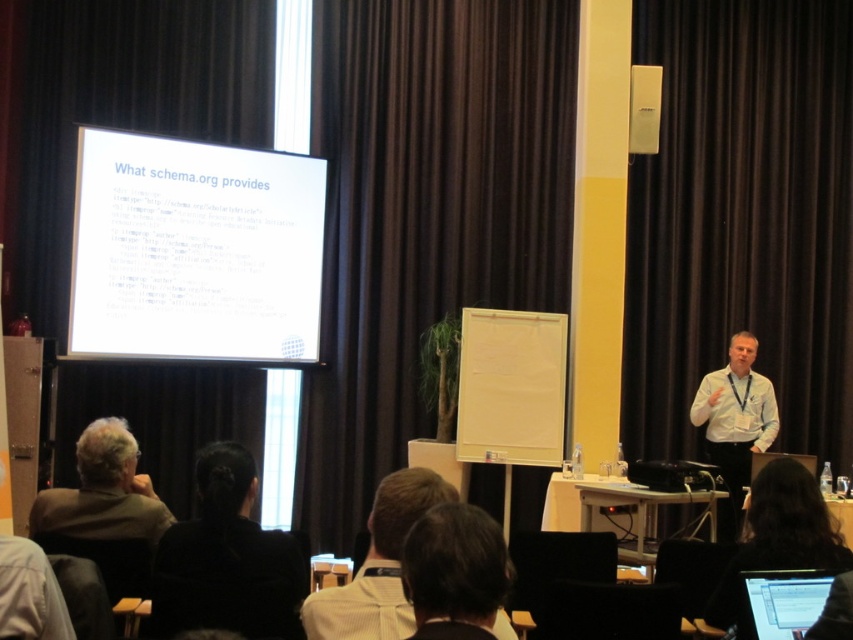
Which is more to the left, white paper at upper center or black fabric hair at lower center?

white paper at upper center is more to the left.

Can you confirm if white paper at upper center is smaller than black fabric hair at lower center?

No.

Does point (212, 326) come behind point (231, 552)?

Yes, point (212, 326) is behind point (231, 552).

At what (x,y) coordinates should I click in order to perform the action: click on white paper at upper center. Please return your answer as a coordinate pair (x, y). Looking at the image, I should click on (194, 250).

Based on the photo, does black fabric hair at lower center lie in front of light brown shirt at center?

That is False.

Can you confirm if black fabric hair at lower center is thinner than light brown shirt at center?

No, black fabric hair at lower center is not thinner than light brown shirt at center.

Does point (265, 634) come in front of point (337, 602)?

No, (265, 634) is behind (337, 602).

You are a GUI agent. You are given a task and a screenshot of the screen. Output one action in this format:
    pyautogui.click(x=<x>, y=<y>)
    Task: Click on the black fabric hair at lower center
    Image resolution: width=853 pixels, height=640 pixels.
    Given the screenshot: What is the action you would take?
    pyautogui.click(x=227, y=557)

Image resolution: width=853 pixels, height=640 pixels. Describe the element at coordinates (425, 212) in the screenshot. I see `brown fabric curtain at upper center` at that location.

Which of these two, brown fabric curtain at upper center or black fabric hair at lower center, stands shorter?

With less height is black fabric hair at lower center.

You are a GUI agent. You are given a task and a screenshot of the screen. Output one action in this format:
    pyautogui.click(x=<x>, y=<y>)
    Task: Click on the brown fabric curtain at upper center
    Image resolution: width=853 pixels, height=640 pixels.
    Given the screenshot: What is the action you would take?
    pyautogui.click(x=425, y=212)